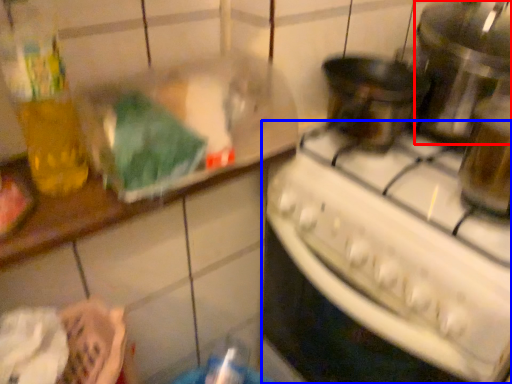
Question: Which point is closer to the camera, appliance (highlighted by a red box) or kitchen appliance (highlighted by a blue box)?

Choices:
 (A) appliance
 (B) kitchen appliance

Answer: (B)